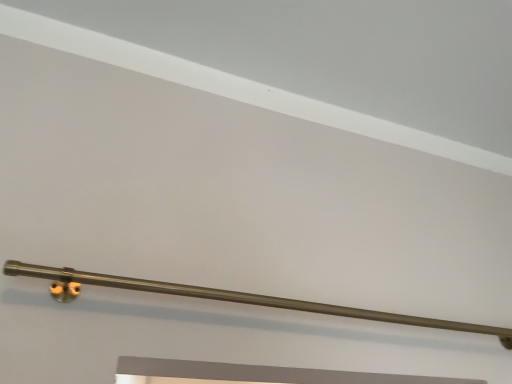
Describe the element at coordinates (229, 298) in the screenshot. I see `polished brass rod at lower center` at that location.

Identify the location of polished brass rod at lower center. This screenshot has height=384, width=512. (229, 298).

Locate an element on the screen. The image size is (512, 384). polished brass rod at lower center is located at coordinates [x=229, y=298].